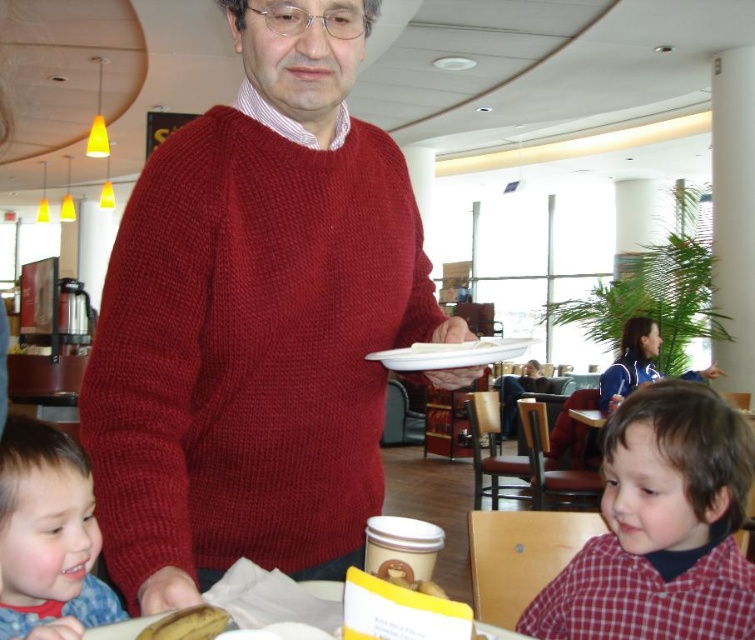
Looking at this image, you are a server in a restaurant. You see a customer wearing a knitted red sweater at center and another wearing a red checkered shirt at lower right. Which customer is closer to the left side of the room?

The knitted red sweater at center is closer to the left side of the room than the red checkered shirt at lower right.